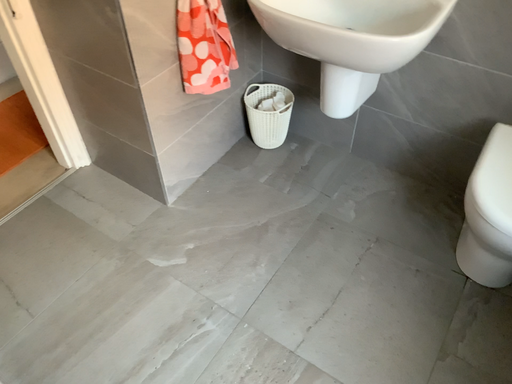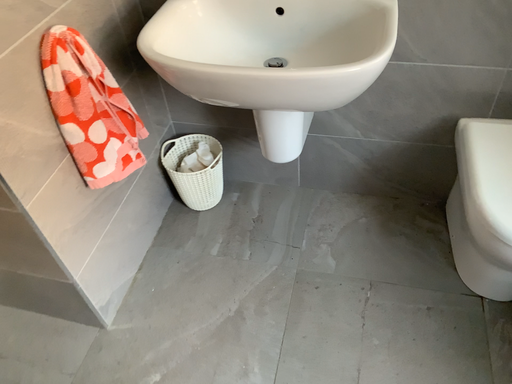
Question: How did the camera likely rotate when shooting the video?

Choices:
 (A) rotated right
 (B) rotated left

Answer: (A)